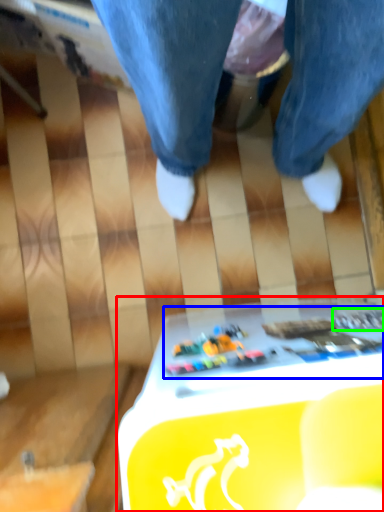
Question: Estimate the real-world distances between objects in this image. Which object is farther from table (highlighted by a red box), writing (highlighted by a blue box) or writing (highlighted by a green box)?

Choices:
 (A) writing
 (B) writing

Answer: (B)